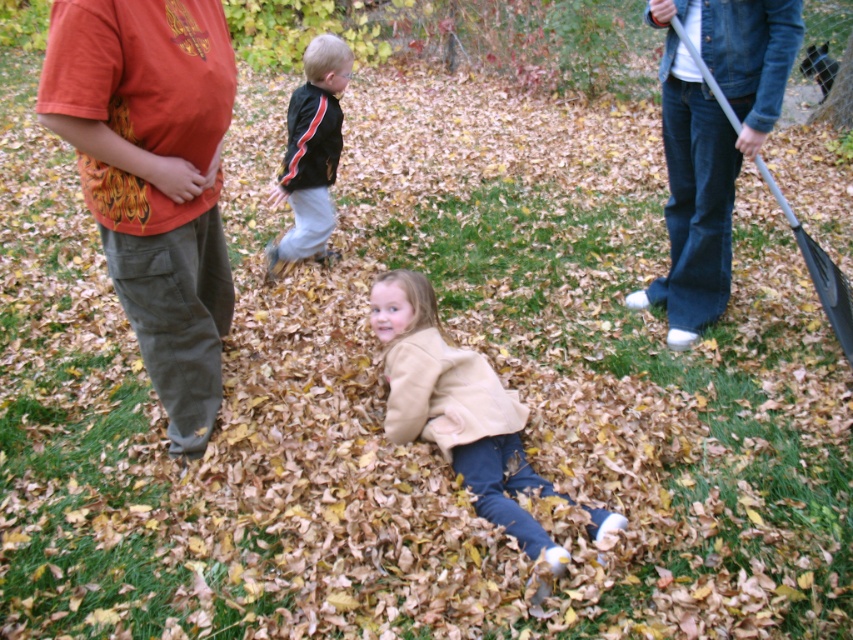
Between beige soft coat at center and metallic gray shovel at right, which one has more height?

Standing taller between the two is metallic gray shovel at right.

What do you see at coordinates (456, 408) in the screenshot?
I see `beige soft coat at center` at bounding box center [456, 408].

This screenshot has height=640, width=853. In order to click on beige soft coat at center in this screenshot , I will do `click(456, 408)`.

Find the location of `beige soft coat at center`. beige soft coat at center is located at coordinates (456, 408).

Between orange t-shirt at left and black matte jacket at center, which one has less height?

black matte jacket at center

Is point (209, 76) positioned in front of point (314, 170)?

Yes, it is.

Which is behind, point (206, 22) or point (318, 40)?

The point (318, 40) is more distant.

The height and width of the screenshot is (640, 853). Find the location of `orange t-shirt at left`. orange t-shirt at left is located at coordinates (154, 179).

Who is more forward, (160, 298) or (711, 84)?

Point (160, 298) is in front.

Is orange t-shirt at left to the right of metallic gray shovel at right from the viewer's perspective?

Incorrect, orange t-shirt at left is not on the right side of metallic gray shovel at right.

Which is in front, point (158, 74) or point (844, 330)?

Point (158, 74) is in front.

You are a GUI agent. You are given a task and a screenshot of the screen. Output one action in this format:
    pyautogui.click(x=<x>, y=<y>)
    Task: Click on the orange t-shirt at left
    
    Given the screenshot: What is the action you would take?
    pyautogui.click(x=154, y=179)